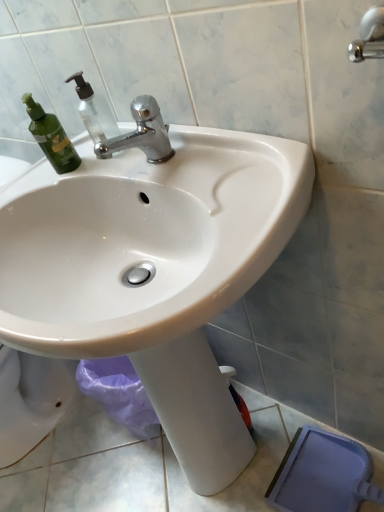
Find the location of a particular element. vacant space in front of polished chrome faucet at upper center is located at coordinates (207, 182).